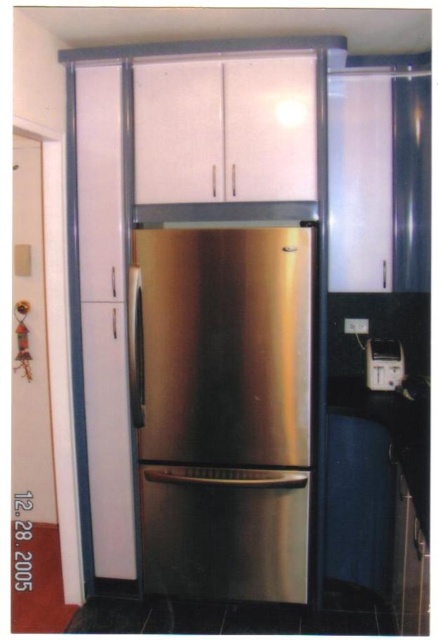
Question: From the image, what is the correct spatial relationship of stainless steel refrigerator at center in relation to metallic silver toaster at center?

Choices:
 (A) left
 (B) right

Answer: (A)

Question: Is stainless steel refrigerator at center in front of metallic silver toaster at center?

Choices:
 (A) no
 (B) yes

Answer: (B)

Question: Where is stainless steel refrigerator at center located in relation to metallic silver toaster at center in the image?

Choices:
 (A) right
 (B) left

Answer: (B)